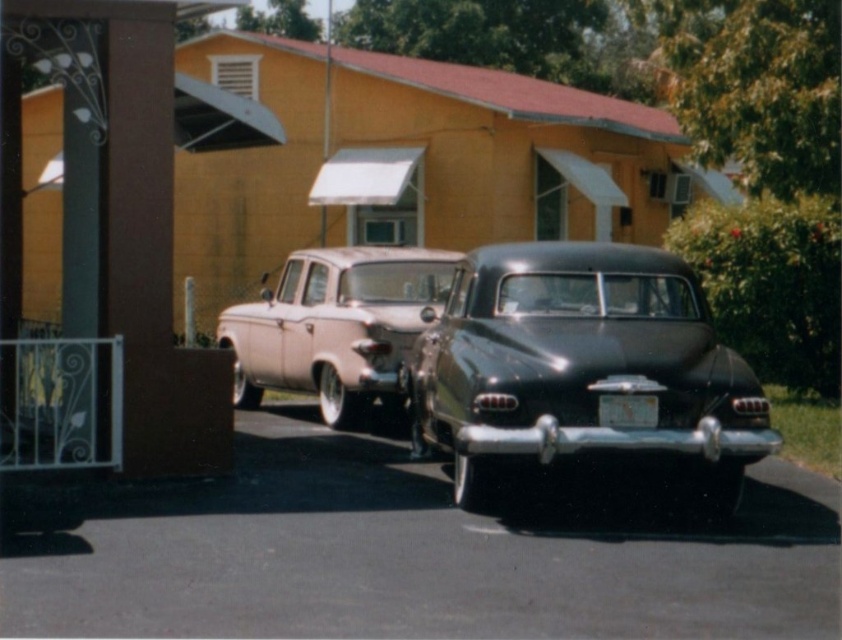
Question: Can you confirm if shiny black sedan at center is positioned above light pink glossy sedan at center?

Choices:
 (A) yes
 (B) no

Answer: (B)

Question: Which point is farther from the camera taking this photo?

Choices:
 (A) [457, 259]
 (B) [435, 424]

Answer: (A)

Question: Can you confirm if shiny black sedan at center is wider than light pink glossy sedan at center?

Choices:
 (A) yes
 (B) no

Answer: (B)

Question: Is shiny black sedan at center smaller than light pink glossy sedan at center?

Choices:
 (A) no
 (B) yes

Answer: (A)

Question: Among these points, which one is nearest to the camera?

Choices:
 (A) (593, 323)
 (B) (386, 289)

Answer: (A)